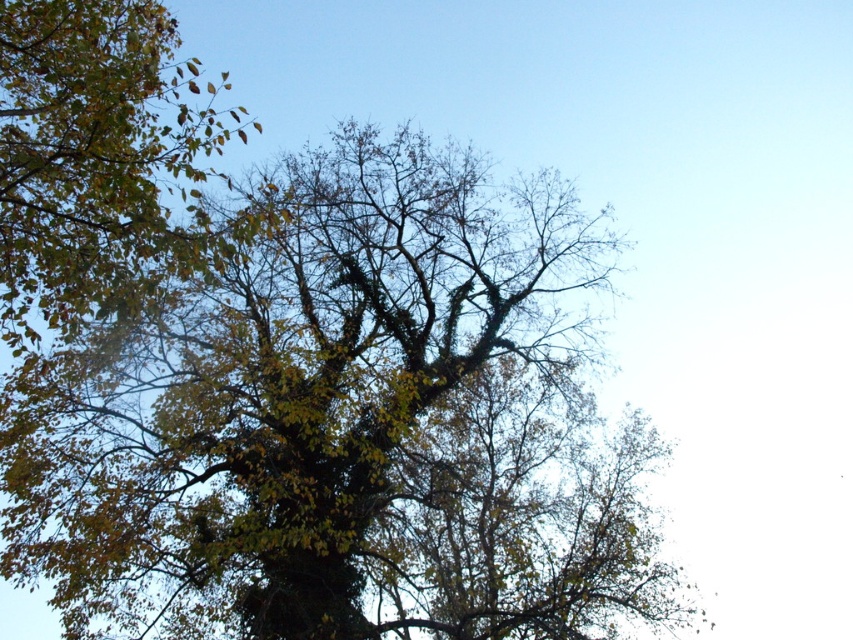
Based on the scene description, which tree is located to the right of the other? The green leafy oak tree at center or the green leafy tree at upper left?

The green leafy oak tree at center is positioned on the right side of green leafy tree at upper left, so the green leafy oak tree at center is to the right of the green leafy tree at upper left.

You are planning to install a bird feeder between the green leafy oak tree at center and the green leafy tree at upper left. The bird feeder requires a minimum of 10 meters of space between the two trees to be installed safely. Can you install it?

The green leafy oak tree at center and green leafy tree at upper left are 11.92 meters apart, which is more than the required 10 meters. Therefore, the bird feeder can be installed safely between them.

You are standing at the base of the green leafy oak tree at center and want to look up at the green leafy tree at upper left. Which direction should you tilt your head to see it?

You should tilt your head upward to see the green leafy tree at upper left because it is positioned above the green leafy oak tree at center.